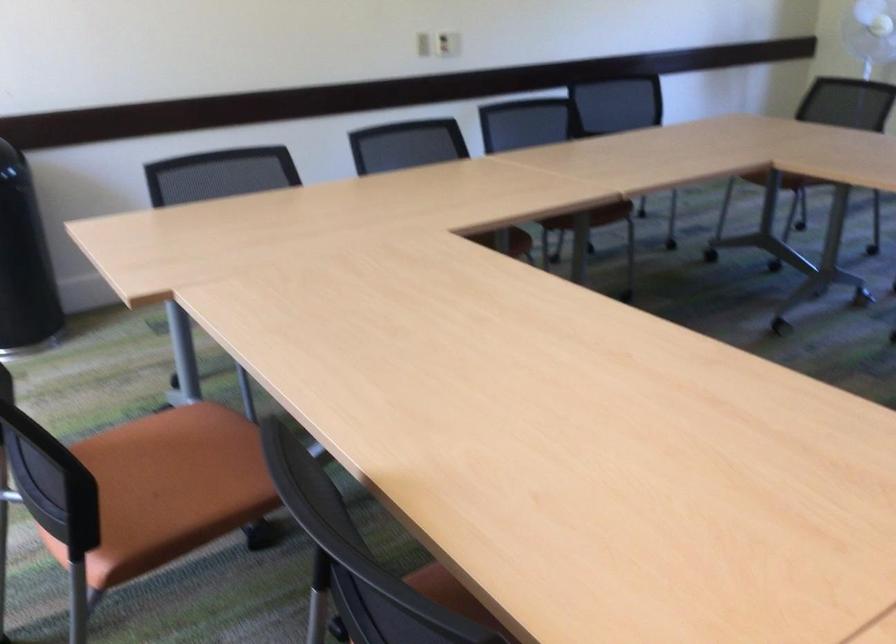
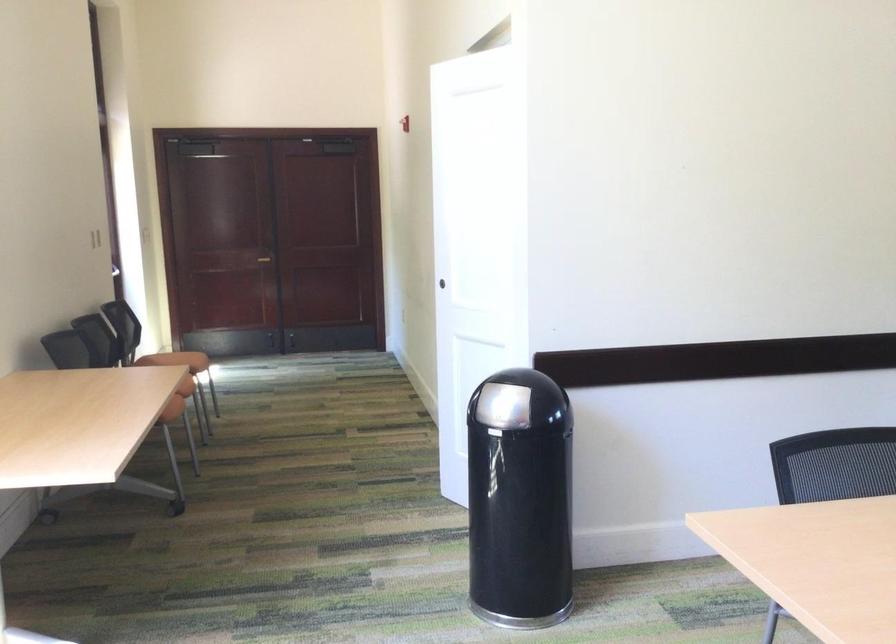
In a continuous first-person perspective shot, in which direction is the camera moving?

The cameraman moved toward left, forward.